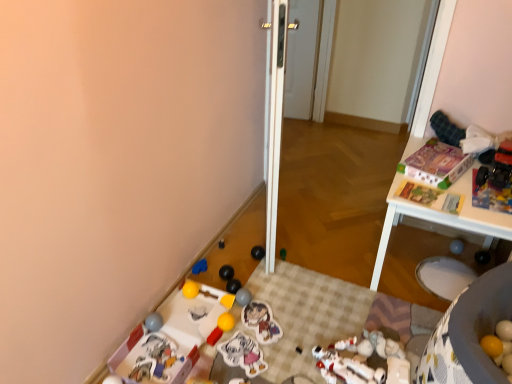
At what (x,y) coordinates should I click in order to perform the action: click on vacant space that's between yellow matte toy at lower center, acting as the 12th toy starting from the right, and matte plastic sticker at center, arranged as the thirteenth toy when viewed from the left. Please return your answer as a coordinate pair (x, y). The image size is (512, 384). Looking at the image, I should click on (237, 318).